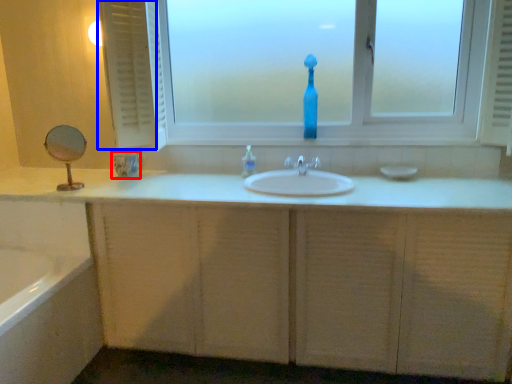
Question: Which point is closer to the camera, glass vase (highlighted by a red box) or curtain (highlighted by a blue box)?

Choices:
 (A) glass vase
 (B) curtain

Answer: (B)